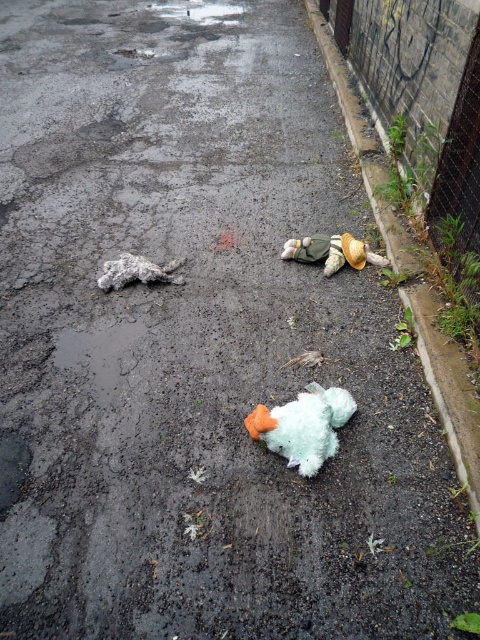
Which is above, fuzzy teal stuffed animal at center or fuzzy gray animal at upper left?

Positioned higher is fuzzy gray animal at upper left.

Is fuzzy teal stuffed animal at center bigger than fuzzy gray animal at upper left?

Correct, fuzzy teal stuffed animal at center is larger in size than fuzzy gray animal at upper left.

What are the coordinates of `fuzzy teal stuffed animal at center` in the screenshot? It's located at (303, 426).

Is concrete curb at right bigger than fuzzy gray animal at upper left?

Yes.

Find the location of a particular element. concrete curb at right is located at coordinates point(447,388).

This screenshot has height=640, width=480. I want to click on concrete curb at right, so click(447, 388).

Which is behind, point (312, 458) or point (321, 259)?

The point (321, 259) is behind.

Between fuzzy teal stuffed animal at center and fuzzy fabric teddy bear at center, which one is positioned higher?

fuzzy fabric teddy bear at center is higher up.

Between point (310, 474) and point (384, 260), which one is positioned behind?

Positioned behind is point (384, 260).

The image size is (480, 640). I want to click on fuzzy teal stuffed animal at center, so (303, 426).